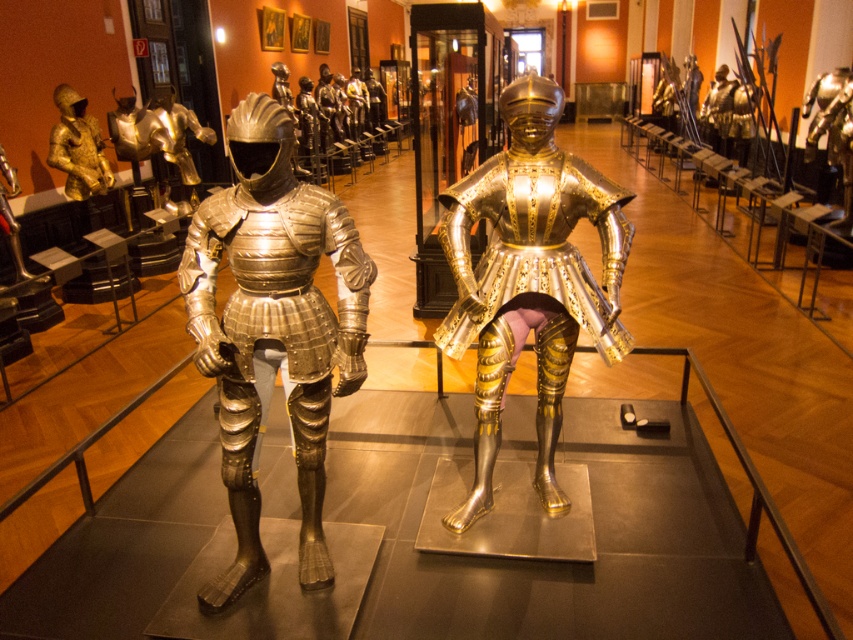
You are a museum visitor standing in the middle of the hallway. You see two suits of armor at the center of the exhibit. Which one is taller, the polished silver armor at center or the shiny silver armor at center?

The polished silver armor at center is taller than the shiny silver armor at center.

You are a museum curator planning to place a new display case between the polished silver armor at center and the gold plated armor at center. The display case requires at least 0.5 meters of space between it and any existing exhibits. Given the current spacing between the two armors, can you safely place the display case between them?

The polished silver armor at center is thinner than the gold plated armor at center, but the description does not provide information about the distance between them. Therefore, it is impossible to determine if there is sufficient space to place the display case between them.